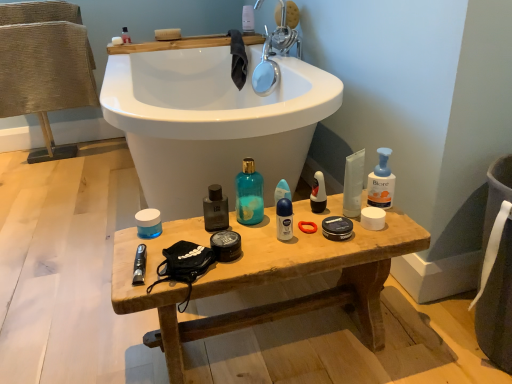
What do you see at coordinates (148, 223) in the screenshot?
I see `translucent plastic jar at center, the 1th toiletry in the bottom-to-top sequence` at bounding box center [148, 223].

This screenshot has height=384, width=512. I want to click on white matte tube at center right, which is the 2th cleaning product in left-to-right order, so click(x=353, y=184).

Describe the element at coordinates (45, 66) in the screenshot. I see `textured woven fabric at upper left` at that location.

This screenshot has height=384, width=512. What do you see at coordinates (139, 265) in the screenshot? I see `metallic black razor at lower left` at bounding box center [139, 265].

Where is `matte plastic toothbrush at upper center, marked as the 4th toiletry in a left-to-right arrangement`? This screenshot has width=512, height=384. matte plastic toothbrush at upper center, marked as the 4th toiletry in a left-to-right arrangement is located at coordinates (248, 20).

Where is `matte black bottle at center, positioned as the 2th toiletry in front-to-back order`? matte black bottle at center, positioned as the 2th toiletry in front-to-back order is located at coordinates (215, 209).

Can you confirm if metallic silver spray can at upper left, marked as the 6th toiletry in a bottom-to-top arrangement, is shorter than wooden bench at center?

Yes, metallic silver spray can at upper left, marked as the 6th toiletry in a bottom-to-top arrangement, is shorter than wooden bench at center.

Is the surface of metallic silver spray can at upper left, placed as the 1th toiletry when sorted from left to right, in direct contact with wooden bench at center?

No, metallic silver spray can at upper left, placed as the 1th toiletry when sorted from left to right, is not touching wooden bench at center.

From a real-world perspective, between metallic silver spray can at upper left, placed as the 1th toiletry when sorted from left to right, and wooden bench at center, who is vertically lower?

wooden bench at center is physically lower.

Based on the photo, does metallic silver spray can at upper left, the 6th toiletry positioned from the front, appear on the left side of wooden bench at center?

Indeed, metallic silver spray can at upper left, the 6th toiletry positioned from the front, is positioned on the left side of wooden bench at center.

From the image's perspective, is matte black bottle at center, placed as the 3th toiletry when sorted from bottom to top, above or below matte black deodorant at center, which ranks as the third toiletry in top-to-bottom order?

From the image's perspective, matte black bottle at center, placed as the 3th toiletry when sorted from bottom to top, appears below matte black deodorant at center, which ranks as the third toiletry in top-to-bottom order.

Is matte black bottle at center, positioned as the 2th toiletry in front-to-back order, far from matte black deodorant at center, which ranks as the third toiletry in top-to-bottom order?

matte black bottle at center, positioned as the 2th toiletry in front-to-back order, is near matte black deodorant at center, which ranks as the third toiletry in top-to-bottom order, not far away.

Which is in front, point (219, 197) or point (318, 191)?

The point (219, 197) is closer.

Can you confirm if matte black bottle at center, which appears as the 6th toiletry when viewed from the back, is positioned to the right of matte black deodorant at center, which is the 4th toiletry from back to front?

No, matte black bottle at center, which appears as the 6th toiletry when viewed from the back, is not to the right of matte black deodorant at center, which is the 4th toiletry from back to front.

From a real-world perspective, is white matte deodorant at center, the third toiletry in the right-to-left sequence, above or below matte plastic toothbrush at upper center, which appears as the 1th toiletry when viewed from the top?

In terms of real-world spatial position, white matte deodorant at center, the third toiletry in the right-to-left sequence, is below matte plastic toothbrush at upper center, which appears as the 1th toiletry when viewed from the top.

Considering the relative sizes of white matte deodorant at center, the first toiletry viewed from the front, and matte plastic toothbrush at upper center, positioned as the 4th toiletry in right-to-left order, in the image provided, is white matte deodorant at center, the first toiletry viewed from the front, bigger than matte plastic toothbrush at upper center, positioned as the 4th toiletry in right-to-left order,?

Incorrect, white matte deodorant at center, the first toiletry viewed from the front, is not larger than matte plastic toothbrush at upper center, positioned as the 4th toiletry in right-to-left order.

Based on the photo, which of these two, white matte deodorant at center, the first toiletry viewed from the front, or matte plastic toothbrush at upper center, which is the seventh toiletry in bottom-to-top order, stands taller?

matte plastic toothbrush at upper center, which is the seventh toiletry in bottom-to-top order.

From the image's perspective, is white matte deodorant at center, which ranks as the sixth toiletry in top-to-bottom order, positioned above or below matte plastic toothbrush at upper center, positioned as the 1th toiletry in back-to-front order?

white matte deodorant at center, which ranks as the sixth toiletry in top-to-bottom order, is below matte plastic toothbrush at upper center, positioned as the 1th toiletry in back-to-front order.

Is chrome metallic faucet at upper center aimed at translucent plastic jar at center, the 2th toiletry in the left-to-right sequence?

No.

Which of these two, chrome metallic faucet at upper center or translucent plastic jar at center, the 1th toiletry in the bottom-to-top sequence, stands shorter?

With less height is translucent plastic jar at center, the 1th toiletry in the bottom-to-top sequence.

Are chrome metallic faucet at upper center and translucent plastic jar at center, arranged as the 3th toiletry when viewed from the front, far apart?

Indeed, chrome metallic faucet at upper center is not near translucent plastic jar at center, arranged as the 3th toiletry when viewed from the front.

Is white matte deodorant at center, the 2th toiletry ordered from the bottom, positioned behind wooden bench at center?

Yes, white matte deodorant at center, the 2th toiletry ordered from the bottom, is further from the camera.

Is wooden bench at center at the back of white matte deodorant at center, the 2th toiletry ordered from the bottom?

No, white matte deodorant at center, the 2th toiletry ordered from the bottom,'s orientation is not away from wooden bench at center.

From the picture: Which is closer, (282,226) or (337,205)?

Point (282,226) is positioned closer to the camera compared to point (337,205).

Is white matte deodorant at center, the third toiletry in the right-to-left sequence, to the left of wooden bench at center from the viewer's perspective?

In fact, white matte deodorant at center, the third toiletry in the right-to-left sequence, is to the right of wooden bench at center.

Is white matte soap at upper left positioned beyond the bounds of translucent plastic jar at center, the 1th toiletry in the bottom-to-top sequence?

white matte soap at upper left is positioned outside translucent plastic jar at center, the 1th toiletry in the bottom-to-top sequence.

Is translucent plastic jar at center, placed as the sixth toiletry when sorted from right to left, at the back of white matte soap at upper left?

white matte soap at upper left is not turned away from translucent plastic jar at center, placed as the sixth toiletry when sorted from right to left.

In terms of height, does white matte soap at upper left look taller or shorter compared to translucent plastic jar at center, which ranks as the seventh toiletry in top-to-bottom order?

In the image, white matte soap at upper left appears to be shorter than translucent plastic jar at center, which ranks as the seventh toiletry in top-to-bottom order.

In the image, is white matte soap at upper left positioned in front of or behind translucent plastic jar at center, which ranks as the seventh toiletry in top-to-bottom order?

In the image, white matte soap at upper left appears behind translucent plastic jar at center, which ranks as the seventh toiletry in top-to-bottom order.

Based on the photo, which object is positioned more to the right, matte black bottle at center, positioned as the 2th toiletry in front-to-back order, or metallic black razor at lower left?

matte black bottle at center, positioned as the 2th toiletry in front-to-back order.

Are matte black bottle at center, which appears as the 6th toiletry when viewed from the back, and metallic black razor at lower left far apart?

They are positioned close to each other.

In terms of width, does matte black bottle at center, placed as the 5th toiletry when sorted from right to left, look wider or thinner when compared to metallic black razor at lower left?

In the image, matte black bottle at center, placed as the 5th toiletry when sorted from right to left, appears to be more narrow than metallic black razor at lower left.

Is metallic black razor at lower left at the back of matte black bottle at center, positioned as the 2th toiletry in front-to-back order?

No, matte black bottle at center, positioned as the 2th toiletry in front-to-back order, is not facing away from metallic black razor at lower left.

This screenshot has height=384, width=512. Find the location of `the 6th toiletry directly above the wooden bench at center (from a real-world perspective)`. the 6th toiletry directly above the wooden bench at center (from a real-world perspective) is located at coordinates (125, 36).

From the matte black deodorant at center, marked as the 7th toiletry in a left-to-right arrangement, count the 4th toiletry to the left and point to it. Please provide its 2D coordinates.

[(215, 209)]

Estimate the real-world distances between objects in this image. Which object is further from wooden bench at center, blue pump bottle at right, which is the first cleaning product in right-to-left order, or matte black bottle at center, placed as the 3th toiletry when sorted from bottom to top?

blue pump bottle at right, which is the first cleaning product in right-to-left order, is positioned further to the anchor wooden bench at center.

Based on their spatial positions, is white matte deodorant at center, acting as the seventh toiletry starting from the back, or blue pump bottle at right, which is the 3th cleaning product from left to right, further from chrome metallic faucet at upper center?

white matte deodorant at center, acting as the seventh toiletry starting from the back.

Estimate the real-world distances between objects in this image. Which object is further from matte plastic toothbrush at upper center, positioned as the 1th toiletry in back-to-front order, teal glass bottle at center, arranged as the third cleaning product when viewed from the right, or white matte tube at center right, which is the second cleaning product in right-to-left order?

Based on the image, white matte tube at center right, which is the second cleaning product in right-to-left order, appears to be further to matte plastic toothbrush at upper center, positioned as the 1th toiletry in back-to-front order.

Which object lies nearer to the anchor point metallic black razor at lower left, wooden bench at center or white matte deodorant at center, marked as the 5th toiletry in a left-to-right arrangement?

white matte deodorant at center, marked as the 5th toiletry in a left-to-right arrangement, lies closer to metallic black razor at lower left than the other object.

When comparing their distances from matte plastic toothbrush at upper center, marked as the 4th toiletry in a left-to-right arrangement, does metallic black razor at lower left or blue matte deodorant stick at center, which ranks as the 4th toiletry in bottom-to-top order, seem further?

metallic black razor at lower left is positioned further to the anchor matte plastic toothbrush at upper center, marked as the 4th toiletry in a left-to-right arrangement.

Considering their positions, is white matte tube at center right, which is the second cleaning product in right-to-left order, positioned further to matte plastic toothbrush at upper center, marked as the 4th toiletry in a left-to-right arrangement, than chrome metallic faucet at upper center?

Among the two, white matte tube at center right, which is the second cleaning product in right-to-left order, is located further to matte plastic toothbrush at upper center, marked as the 4th toiletry in a left-to-right arrangement.

Estimate the real-world distances between objects in this image. Which object is further from metallic silver spray can at upper left, the 6th toiletry positioned from the front, teal glass bottle at center, arranged as the third cleaning product when viewed from the right, or matte plastic toothbrush at upper center, positioned as the 4th toiletry in right-to-left order?

teal glass bottle at center, arranged as the third cleaning product when viewed from the right, is further to metallic silver spray can at upper left, the 6th toiletry positioned from the front.

From the image, which object appears to be farther from matte plastic toothbrush at upper center, marked as the 4th toiletry in a left-to-right arrangement, matte black bottle at center, placed as the 3th toiletry when sorted from bottom to top, or blue pump bottle at right, which is the 3th cleaning product from left to right?

blue pump bottle at right, which is the 3th cleaning product from left to right, is further to matte plastic toothbrush at upper center, marked as the 4th toiletry in a left-to-right arrangement.

The height and width of the screenshot is (384, 512). What are the coordinates of `tap positioned between metallic black razor at lower left and matte plastic toothbrush at upper center, which is the seventh toiletry in bottom-to-top order, from near to far` in the screenshot? It's located at (274, 54).

Find the location of a particular element. tap positioned between blue matte deodorant stick at center, which is the second toiletry in right-to-left order, and metallic silver spray can at upper left, placed as the 1th toiletry when sorted from left to right, from near to far is located at coordinates (274, 54).

At what (x,y) coordinates should I click in order to perform the action: click on toiletry between blue matte deodorant stick at center, which ranks as the 4th toiletry in bottom-to-top order, and white matte tube at center right, which is the second cleaning product in right-to-left order, from left to right. Please return your answer as a coordinate pair (x, y). The width and height of the screenshot is (512, 384). Looking at the image, I should click on (318, 193).

Find the location of a particular element. The image size is (512, 384). soap between white matte deodorant at center, the first toiletry viewed from the front, and matte plastic toothbrush at upper center, positioned as the 4th toiletry in right-to-left order, from front to back is located at coordinates (117, 40).